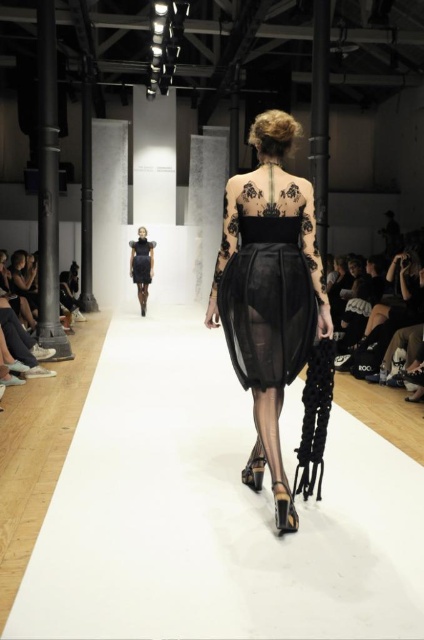
Question: Which point is farther to the camera?

Choices:
 (A) (137, 259)
 (B) (248, 179)

Answer: (A)

Question: Does sheer black fabric dress at center have a lesser width compared to black sheer dress at center?

Choices:
 (A) yes
 (B) no

Answer: (B)

Question: Among these points, which one is nearest to the camera?

Choices:
 (A) (267, 284)
 (B) (147, 273)

Answer: (A)

Question: Which point is closer to the camera taking this photo?

Choices:
 (A) (248, 241)
 (B) (150, 272)

Answer: (A)

Question: Does sheer black fabric dress at center have a larger size compared to matte black dress at center?

Choices:
 (A) no
 (B) yes

Answer: (B)

Question: Does matte black dress at center have a lesser width compared to black satin dress at center?

Choices:
 (A) yes
 (B) no

Answer: (B)